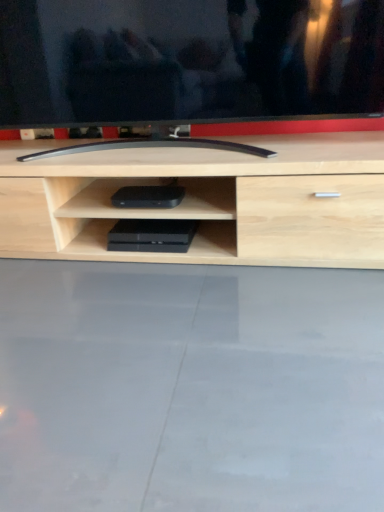
Identify the location of vacant space in front of black plastic game console at center, the first equipment when ordered from bottom to top. This screenshot has width=384, height=512. (157, 257).